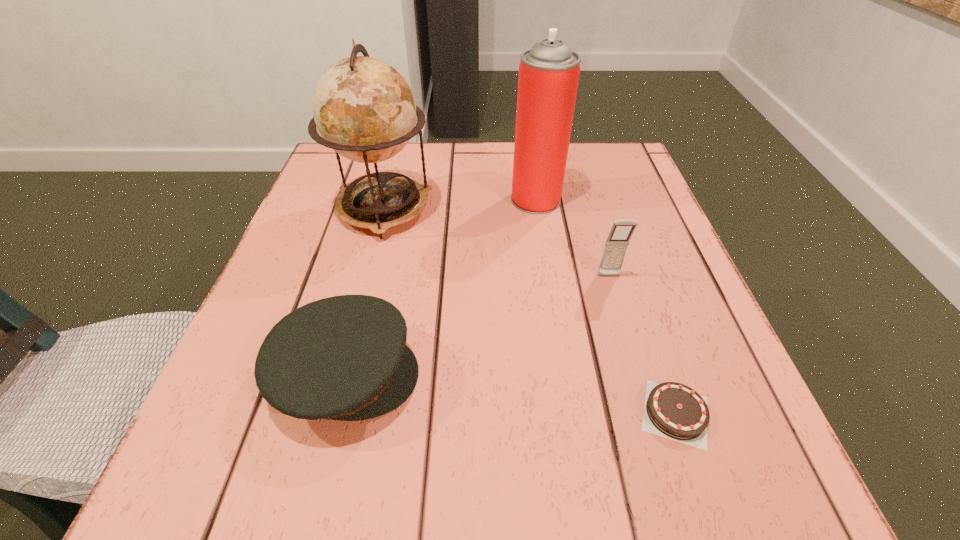
Identify the location of free space that satisfies the following two spatial constraints: 1. on the front-facing side of the cellular telephone; 2. on the front-facing side of the beret. (638, 375).

Identify the location of free location that satisfies the following two spatial constraints: 1. on the front-facing side of the chocolate cake; 2. on the right side of the third tallest object. 649,413.

Locate an element on the screen. Image resolution: width=960 pixels, height=540 pixels. free point that satisfies the following two spatial constraints: 1. on the back side of the chocolate cake; 2. on the front-facing side of the beret is located at coordinates (662, 375).

The image size is (960, 540). Identify the location of vacant space that satisfies the following two spatial constraints: 1. at the center of the globe; 2. on the left side of the shortest object. (331, 413).

Identify the location of vacant space that satisfies the following two spatial constraints: 1. on the front-facing side of the cellular telephone; 2. on the front-facing side of the beret. (638, 375).